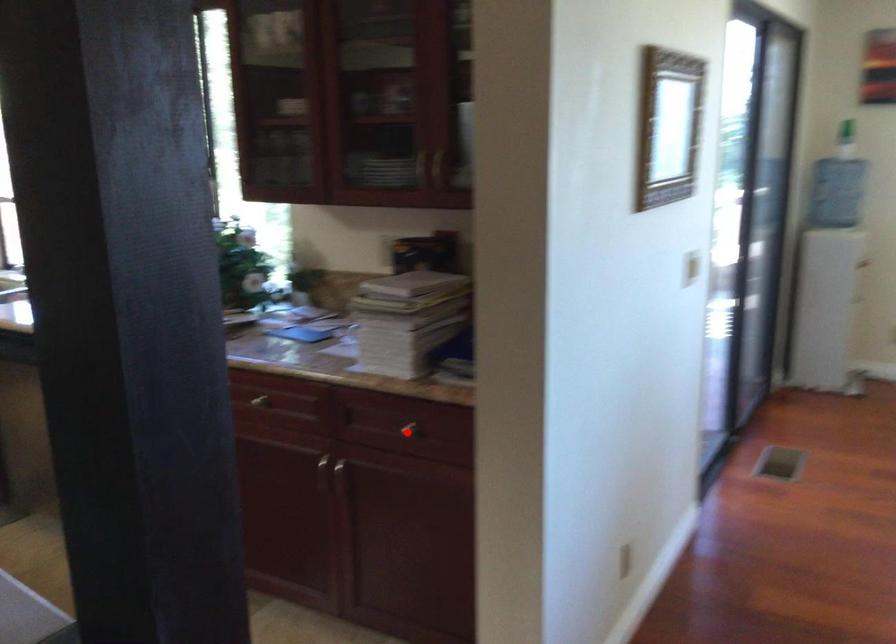
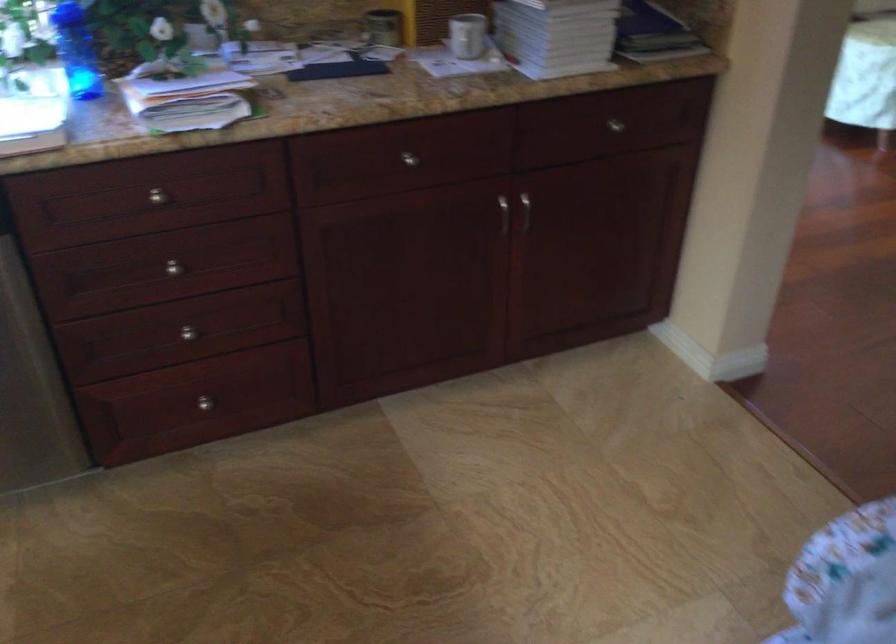
In the second image, find the point that corresponds to the highlighted location in the first image.

(615, 125)